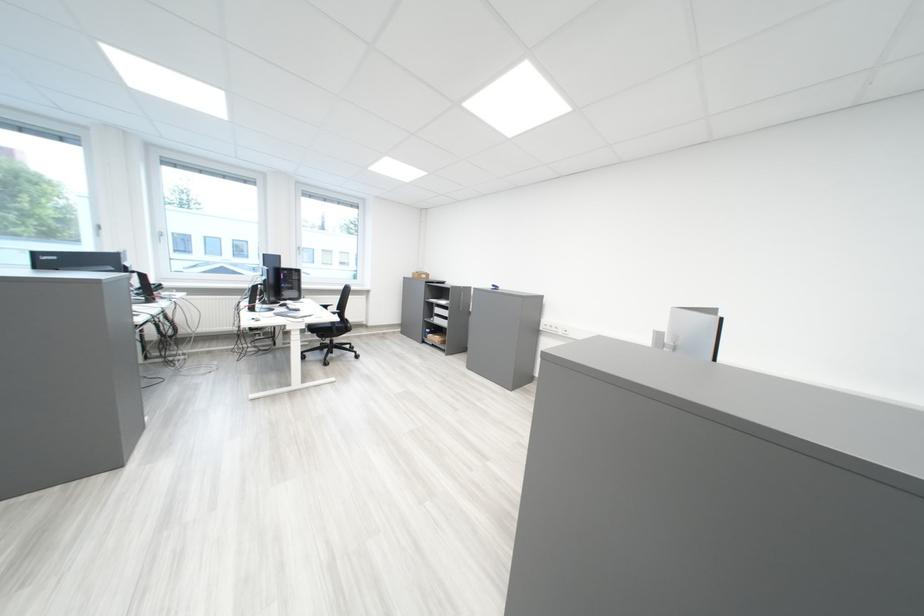
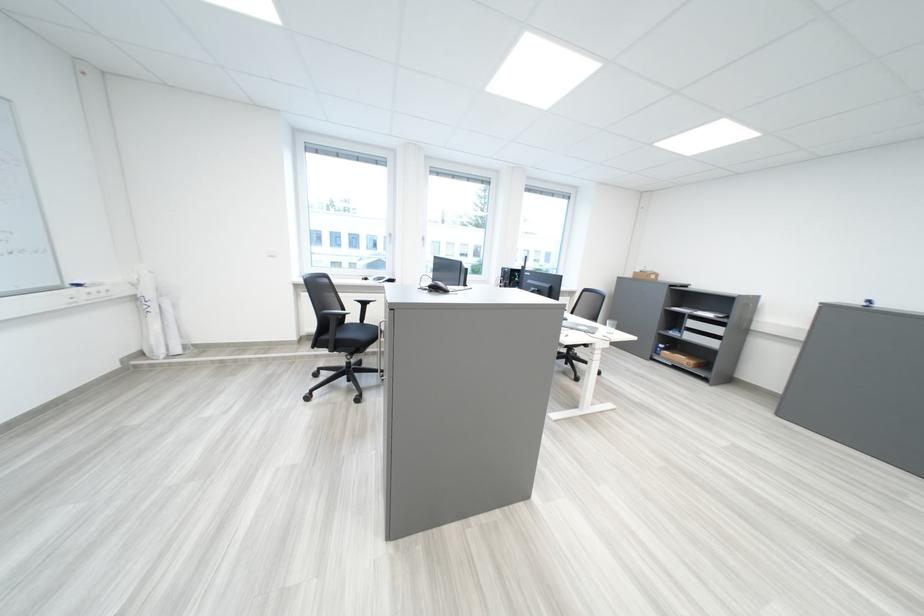
Question: In a continuous first-person perspective shot, in which direction is the camera moving?

Choices:
 (A) Left
 (B) Right
 (C) Forward
 (D) Backward

Answer: (A)